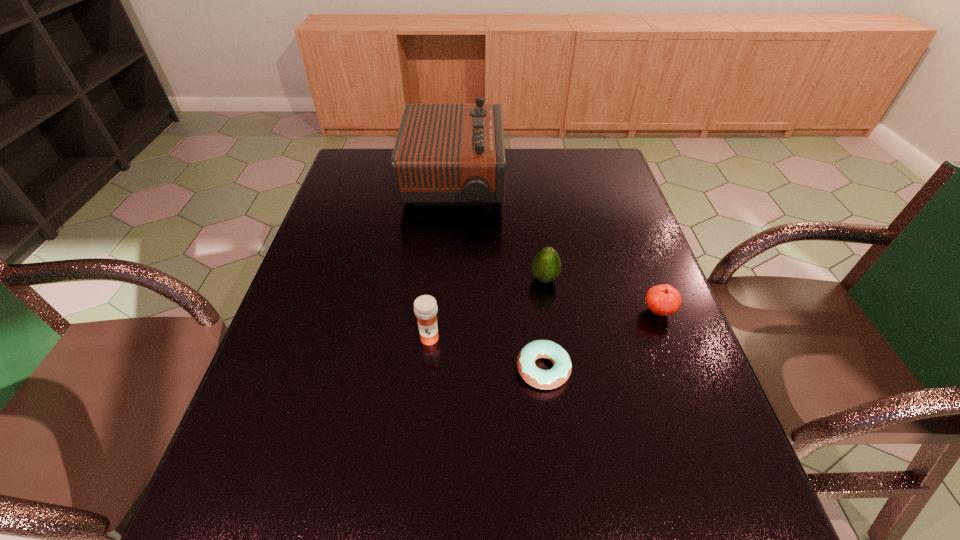
Find the location of `vacant position in the image that satisfies the following two spatial constraints: 1. on the tuning display of the tallest object; 2. on the label side of the medicine`. vacant position in the image that satisfies the following two spatial constraints: 1. on the tuning display of the tallest object; 2. on the label side of the medicine is located at coordinates (442, 338).

In order to click on vacant area that satisfies the following two spatial constraints: 1. on the back side of the second farthest object; 2. on the tuning display of the farthest object in this screenshot , I will do `click(531, 183)`.

I want to click on vacant point that satisfies the following two spatial constraints: 1. on the back side of the doughnut; 2. on the tuning display of the farthest object, so click(x=521, y=183).

Where is `vacant position in the image that satisfies the following two spatial constraints: 1. on the label side of the shortest object; 2. on the right side of the medicine`? The width and height of the screenshot is (960, 540). vacant position in the image that satisfies the following two spatial constraints: 1. on the label side of the shortest object; 2. on the right side of the medicine is located at coordinates (426, 369).